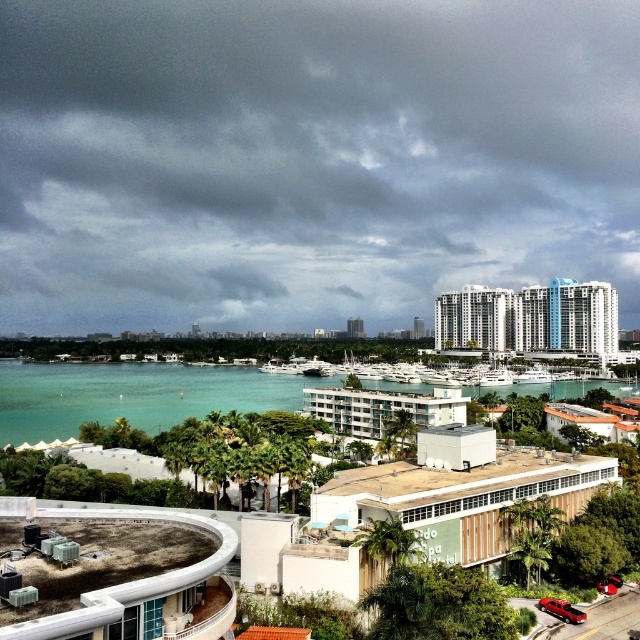
Question: Considering the relative positions of teal water at center and white glossy building at center in the image provided, where is teal water at center located with respect to white glossy building at center?

Choices:
 (A) left
 (B) right

Answer: (A)

Question: Which of the following is the closest to the observer?

Choices:
 (A) dark gray cloud at upper center
 (B) beige wooden building at center

Answer: (B)

Question: Is the position of concrete roof at lower left less distant than that of white glossy building at upper right?

Choices:
 (A) no
 (B) yes

Answer: (B)

Question: Which point appears closest to the camera in this image?

Choices:
 (A) (173, 531)
 (B) (10, 324)
 (C) (365, 394)

Answer: (A)

Question: Which point appears closest to the camera in this image?

Choices:
 (A) (372, 518)
 (B) (253, 157)
 (C) (70, 604)

Answer: (C)

Question: Is concrete roof at lower left to the right of teal water at center from the viewer's perspective?

Choices:
 (A) yes
 (B) no

Answer: (A)